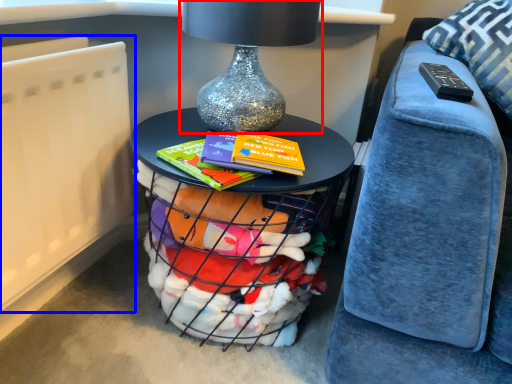
Question: Among these objects, which one is farthest to the camera, table lamp (highlighted by a red box) or radiator (highlighted by a blue box)?

Choices:
 (A) table lamp
 (B) radiator

Answer: (A)